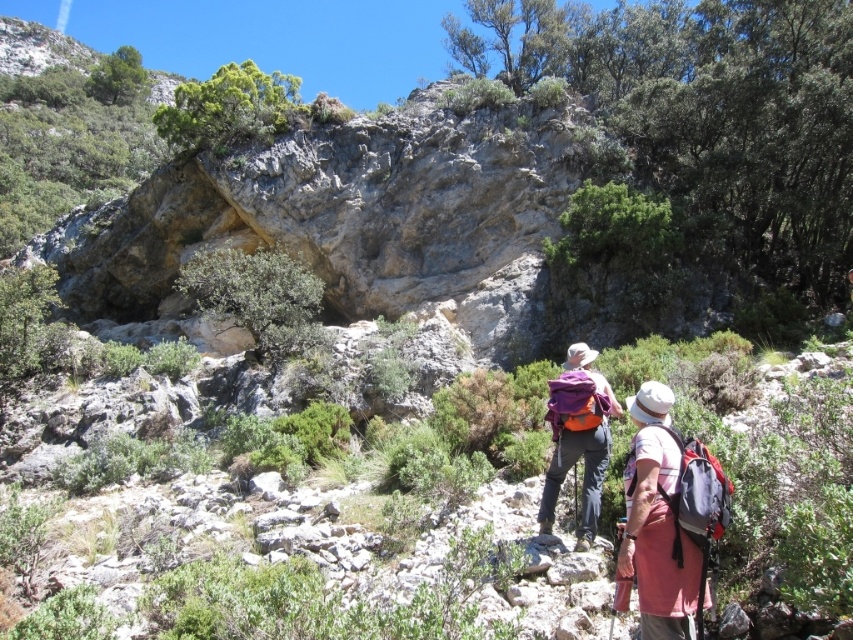
Question: Where is pink fabric backpack at center-right located in relation to purple fabric backpack at center in the image?

Choices:
 (A) above
 (B) below

Answer: (A)

Question: Which point appears closest to the camera in this image?

Choices:
 (A) (664, 406)
 (B) (573, 428)

Answer: (A)

Question: Which object is positioned farthest from the pink fabric backpack at center-right?

Choices:
 (A) matte purple backpack at center
 (B) purple fabric backpack at center

Answer: (B)

Question: Does matte purple backpack at center have a lesser width compared to purple fabric backpack at center?

Choices:
 (A) yes
 (B) no

Answer: (B)

Question: Which object is the closest to the purple fabric backpack at center?

Choices:
 (A) matte purple backpack at center
 (B) pink fabric backpack at center-right

Answer: (B)

Question: Can you confirm if pink fabric backpack at center-right is positioned above purple fabric backpack at center?

Choices:
 (A) yes
 (B) no

Answer: (A)